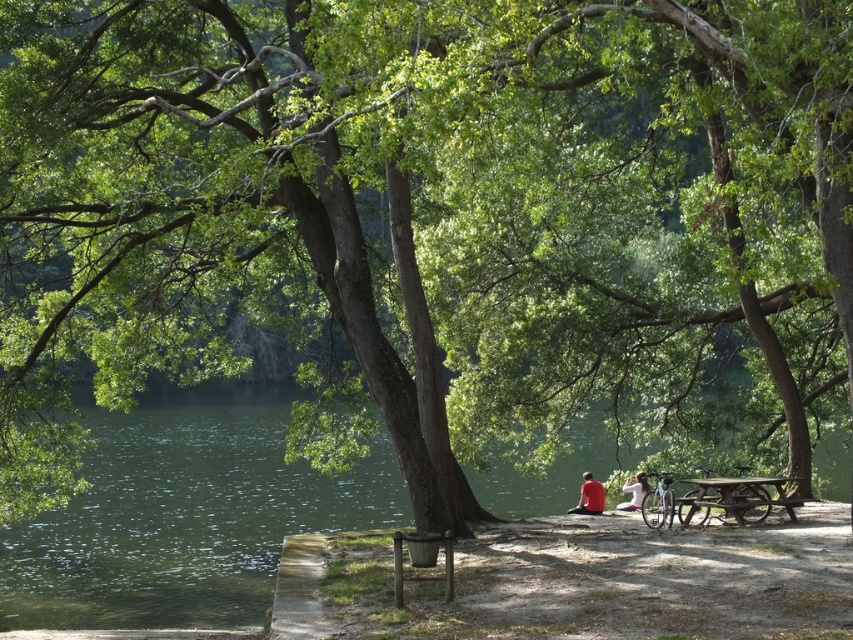
Which of these two, wooden picnic table at lower right or matte red shirt at center, stands shorter?

wooden picnic table at lower right is shorter.

Is wooden picnic table at lower right positioned at the back of matte red shirt at center?

That is False.

Where is `wooden picnic table at lower right`? The width and height of the screenshot is (853, 640). wooden picnic table at lower right is located at coordinates 735,497.

Looking at this image, can you confirm if red matte shirt at center is positioned to the left of white fabric shirt at lower center?

Yes, red matte shirt at center is to the left of white fabric shirt at lower center.

Is red matte shirt at center bigger than white fabric shirt at lower center?

Correct, red matte shirt at center is larger in size than white fabric shirt at lower center.

Is point (590, 508) more distant than point (636, 486)?

Yes, it is.

Where is `red matte shirt at center`? Image resolution: width=853 pixels, height=640 pixels. red matte shirt at center is located at coordinates (589, 497).

Who is lower down, matte red shirt at center or red matte shirt at center?

Positioned lower is red matte shirt at center.

Which of these two, matte red shirt at center or red matte shirt at center, stands shorter?

matte red shirt at center is shorter.

Is point (633, 497) more distant than point (602, 502)?

No.

Where is `matte red shirt at center`? The width and height of the screenshot is (853, 640). matte red shirt at center is located at coordinates (589, 497).